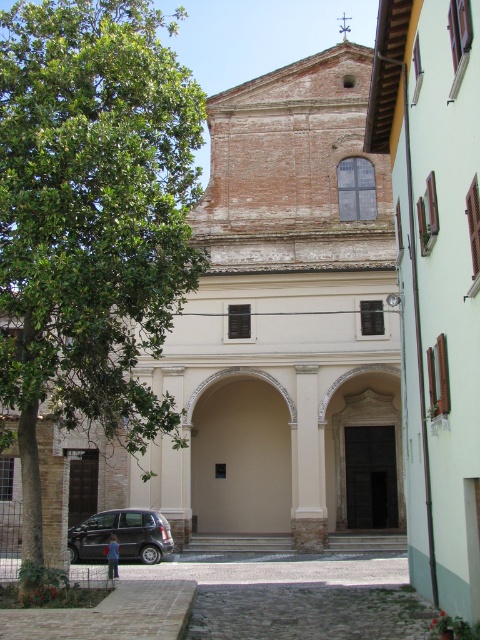
Question: Which point is farther to the camera?

Choices:
 (A) brick textured church at center
 (B) beige stone archway at center

Answer: (B)

Question: Among these points, which one is farthest from the camera?

Choices:
 (A) (8, 33)
 (B) (400, 492)

Answer: (B)

Question: Which point is farther to the camera?

Choices:
 (A) (256, 396)
 (B) (267, 406)
 (C) (164, 394)

Answer: (A)

Question: Observing the image, what is the correct spatial positioning of brick textured church at center in reference to green leafy tree at left?

Choices:
 (A) above
 (B) below

Answer: (B)

Question: Does beige stone archway at center come in front of silver metallic car at lower left?

Choices:
 (A) yes
 (B) no

Answer: (B)

Question: Does green leafy tree at left come behind silver metallic car at lower left?

Choices:
 (A) no
 (B) yes

Answer: (A)